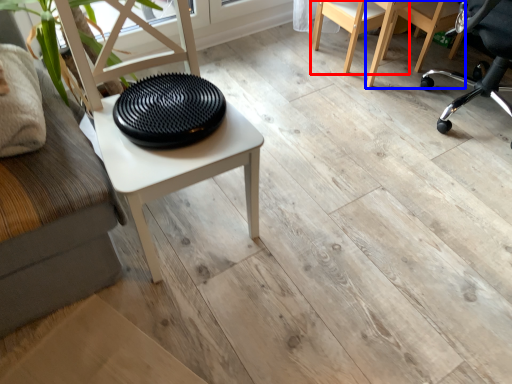
Question: Which object appears farthest to the camera in this image, chair (highlighted by a red box) or chair (highlighted by a blue box)?

Choices:
 (A) chair
 (B) chair

Answer: (B)